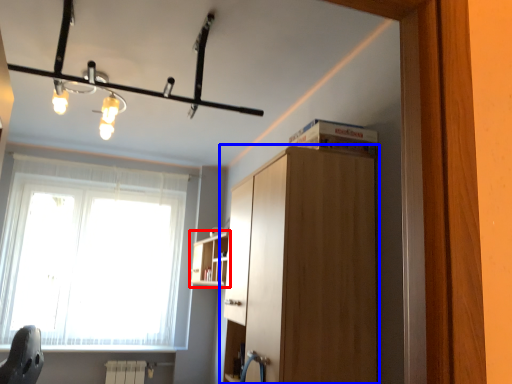
Question: Which of the following is the farthest to the observer, shelf (highlighted by a red box) or cabinetry (highlighted by a blue box)?

Choices:
 (A) shelf
 (B) cabinetry

Answer: (A)